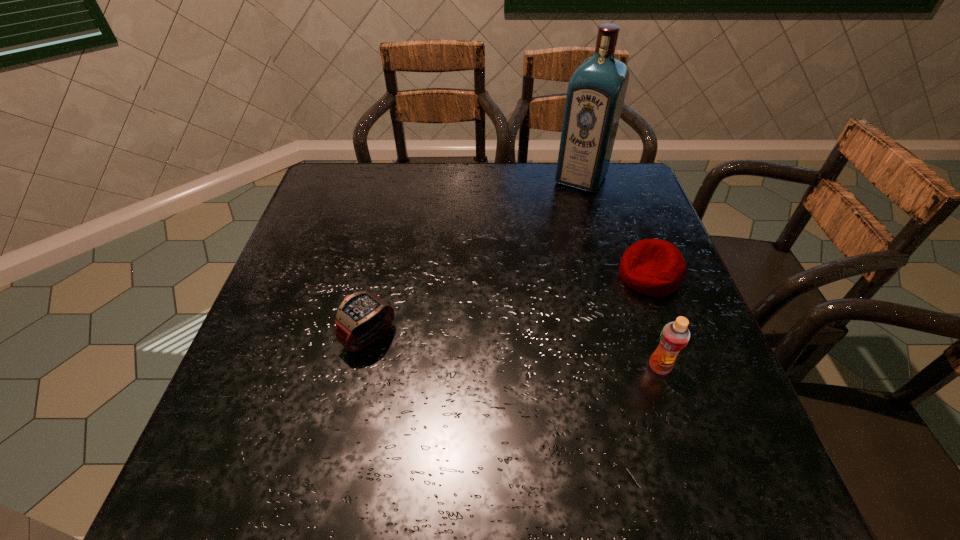
Identify the location of free space on the desktop that is between the watch and the third shortest object and is positioned on the seat area of the beanbag. The width and height of the screenshot is (960, 540). (478, 348).

The width and height of the screenshot is (960, 540). Find the location of `vacant spot on the desktop that is between the second shortest object and the orange juice and is positioned on the flat label side of the tallest object`. vacant spot on the desktop that is between the second shortest object and the orange juice and is positioned on the flat label side of the tallest object is located at coordinates (477, 348).